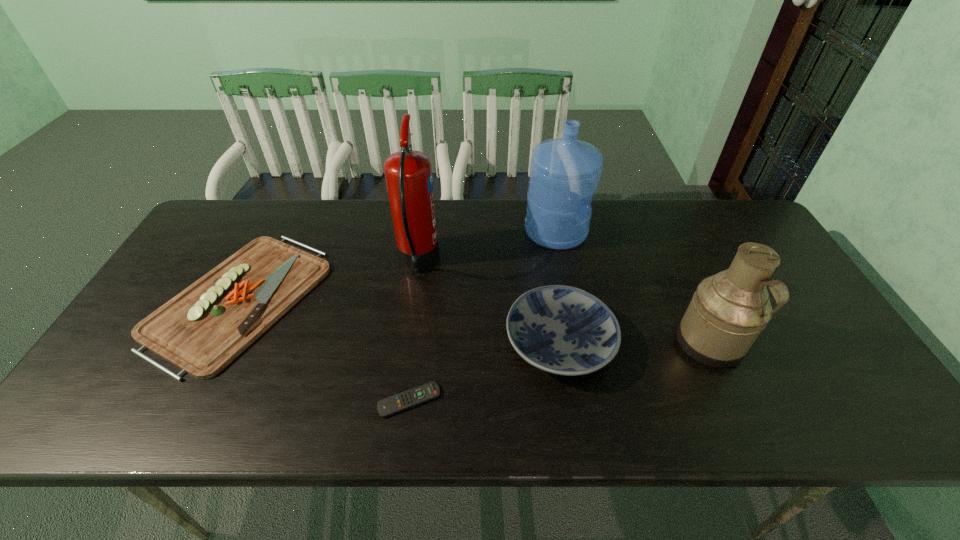
Where is `vacant space at the far edge of the desktop`? The height and width of the screenshot is (540, 960). vacant space at the far edge of the desktop is located at coordinates (381, 234).

Find the location of `vacant space at the left edge of the desktop`. vacant space at the left edge of the desktop is located at coordinates (239, 246).

Find the location of a particular element. The height and width of the screenshot is (540, 960). blank space at the right edge is located at coordinates (789, 279).

This screenshot has width=960, height=540. In the image, there is a desktop. In order to click on blank space at the far right corner in this screenshot , I will do `click(746, 239)`.

This screenshot has height=540, width=960. Identify the location of blank region between the water jug and the pitcher. (633, 287).

Identify the location of free space between the fire extinguisher and the fourth tallest object. This screenshot has width=960, height=540. (489, 302).

Find the location of a particular element. blank region between the fire extinguisher and the plate is located at coordinates (489, 302).

You are a GUI agent. You are given a task and a screenshot of the screen. Output one action in this format:
    pyautogui.click(x=<x>, y=<y>)
    Task: Click on the free space that is in between the leftmost object and the pitcher
    The width and height of the screenshot is (960, 540).
    Given the screenshot: What is the action you would take?
    [475, 321]

Identify the location of vacant area between the remote control and the second shortest object. The image size is (960, 540). (324, 350).

You are a GUI agent. You are given a task and a screenshot of the screen. Output one action in this format:
    pyautogui.click(x=<x>, y=<y>)
    Task: Click on the vacant space that's between the plate and the fifth tallest object
    The height and width of the screenshot is (540, 960).
    Given the screenshot: What is the action you would take?
    pyautogui.click(x=399, y=321)